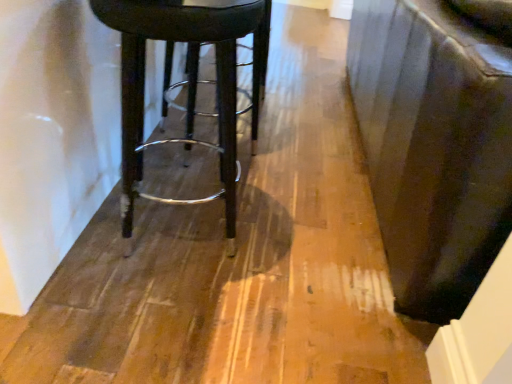
Locate an element on the screen. This screenshot has width=512, height=384. empty space that is to the right of matte black stool at center is located at coordinates (292, 244).